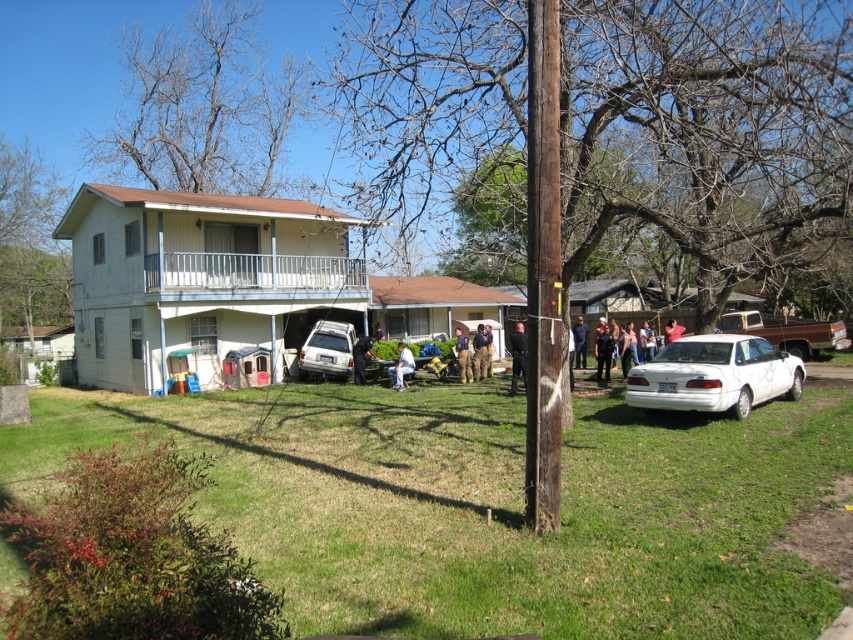
Does white metal porch at upper center have a larger size compared to black uniform at center?

Incorrect, white metal porch at upper center is not larger than black uniform at center.

Who is more distant from viewer, (256, 272) or (511, 387)?

Positioned behind is point (256, 272).

I want to click on white metal porch at upper center, so click(251, 269).

Between green grass at lower center and white metal porch at upper center, which one has more height?

green grass at lower center is taller.

Does point (578, 515) lie behind point (276, 262)?

No, it is in front of (276, 262).

Where is `green grass at lower center`? green grass at lower center is located at coordinates (488, 506).

The image size is (853, 640). Find the location of `green grass at lower center`. green grass at lower center is located at coordinates (488, 506).

Image resolution: width=853 pixels, height=640 pixels. What are the coordinates of `white matte van at center` in the screenshot? It's located at (328, 349).

The image size is (853, 640). Describe the element at coordinates (328, 349) in the screenshot. I see `white matte van at center` at that location.

This screenshot has width=853, height=640. I want to click on white matte van at center, so click(x=328, y=349).